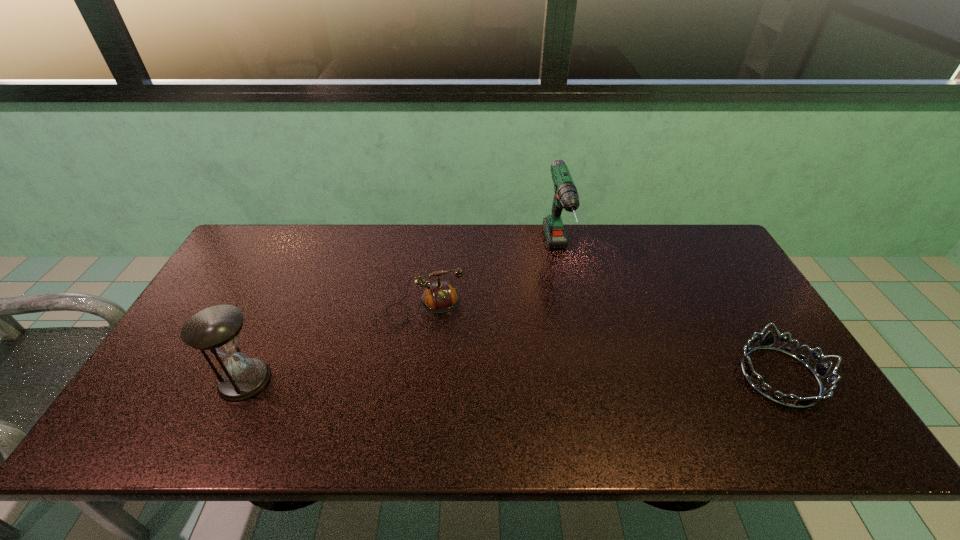
Locate an element on the screen. Image resolution: width=960 pixels, height=540 pixels. vacant position located 0.140m on the rotary dial of the third tallest object is located at coordinates (444, 370).

This screenshot has height=540, width=960. I want to click on vacant space situated on the rotary dial of the third tallest object, so click(454, 407).

Identify the location of free point located 0.260m on the handle side of the farthest object. The height and width of the screenshot is (540, 960). (583, 354).

Find the location of `vacant space located on the handle side of the farthest object`. vacant space located on the handle side of the farthest object is located at coordinates (595, 401).

The width and height of the screenshot is (960, 540). Find the location of `vacant space located 0.370m on the handle side of the farthest object`. vacant space located 0.370m on the handle side of the farthest object is located at coordinates (592, 390).

In order to click on object at the far edge in this screenshot , I will do `click(566, 197)`.

The image size is (960, 540). Identify the location of hourglass located at the near edge. (216, 329).

Locate an element on the screen. The height and width of the screenshot is (540, 960). tiara located in the near edge section of the desktop is located at coordinates (820, 370).

The height and width of the screenshot is (540, 960). Find the location of `object located at the left edge`. object located at the left edge is located at coordinates (216, 329).

This screenshot has height=540, width=960. In order to click on object that is at the right edge in this screenshot , I will do `click(820, 370)`.